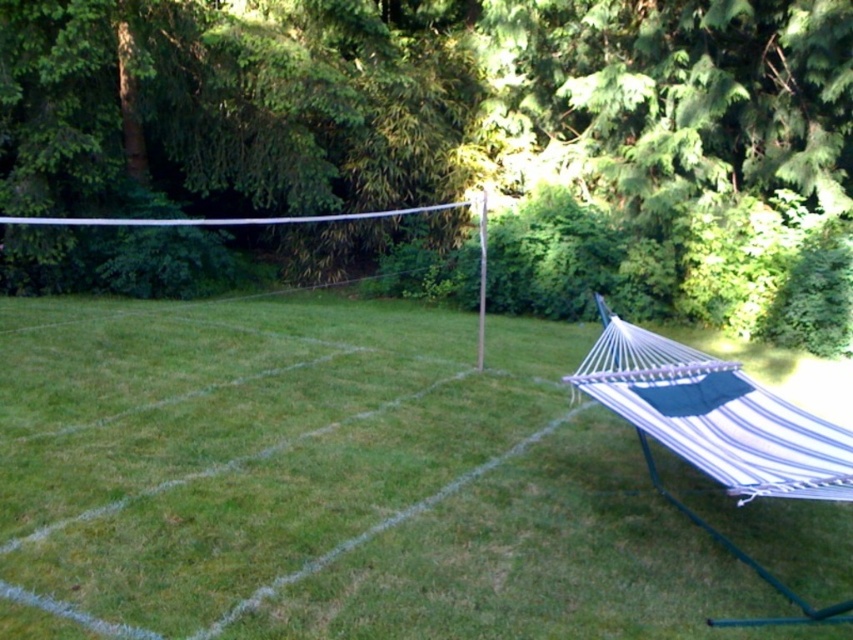
Can you confirm if green grass at center is thinner than white striped fabric hammock at right?

In fact, green grass at center might be wider than white striped fabric hammock at right.

Does point (560, 403) lie in front of point (581, 365)?

Yes, point (560, 403) is in front of point (581, 365).

What are the coordinates of `green grass at center` in the screenshot? It's located at (332, 483).

Who is more forward, (222,627) or (688,88)?

Point (222,627) is in front.

Which is more to the right, green grass at center or green leafy tree at upper center?

Positioned to the right is green leafy tree at upper center.

Between point (119, 312) and point (115, 64), which one is positioned behind?

The point (115, 64) is more distant.

The image size is (853, 640). I want to click on green grass at center, so click(332, 483).

Does green leafy tree at upper center have a lesser width compared to white striped fabric hammock at right?

No.

Can you confirm if green leafy tree at upper center is positioned above white striped fabric hammock at right?

Yes, green leafy tree at upper center is above white striped fabric hammock at right.

Is point (844, 202) positioned after point (677, 502)?

Yes, it is behind point (677, 502).

Image resolution: width=853 pixels, height=640 pixels. Identify the location of green leafy tree at upper center. (421, 97).